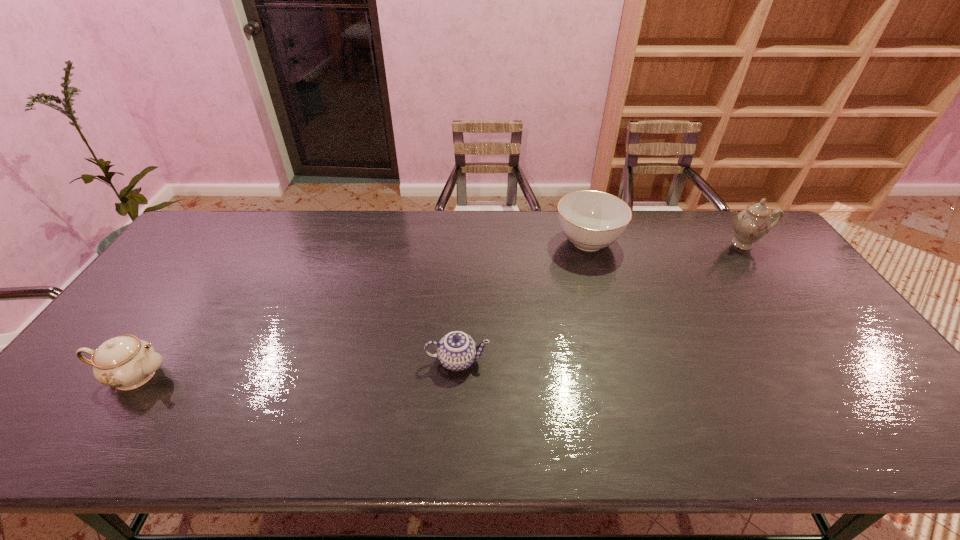
Find the location of a particular element. Image resolution: width=960 pixels, height=540 pixels. object present at the left edge is located at coordinates pos(125,362).

Find the location of a particular element. The width and height of the screenshot is (960, 540). object situated at the right edge is located at coordinates (750, 225).

This screenshot has height=540, width=960. In order to click on object situated at the far right corner in this screenshot , I will do `click(750, 225)`.

The width and height of the screenshot is (960, 540). What are the coordinates of `free space at the far edge of the desktop` in the screenshot? It's located at (711, 220).

Where is `vacant space at the near edge of the desktop`? The image size is (960, 540). vacant space at the near edge of the desktop is located at coordinates (413, 447).

You are a GUI agent. You are given a task and a screenshot of the screen. Output one action in this format:
    pyautogui.click(x=<x>, y=<y>)
    Task: Click on the free space at the right edge
    
    Given the screenshot: What is the action you would take?
    pyautogui.click(x=768, y=255)

In the image, there is a desktop. Where is `vacant region at the far left corner`? The height and width of the screenshot is (540, 960). vacant region at the far left corner is located at coordinates (227, 243).

Find the location of `free space between the second object from left to right and the leftmost chinaware`. free space between the second object from left to right and the leftmost chinaware is located at coordinates (296, 368).

Where is `vacant point located between the third object from left to right and the shortest object`? Image resolution: width=960 pixels, height=540 pixels. vacant point located between the third object from left to right and the shortest object is located at coordinates (523, 301).

This screenshot has width=960, height=540. Identify the location of free space between the leftmost object and the rightmost object. 438,309.